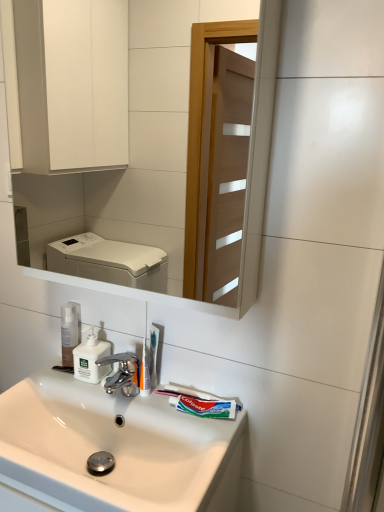
This screenshot has width=384, height=512. Identify the location of vacant area that lies in front of green matte toothpaste at lower center. (207, 440).